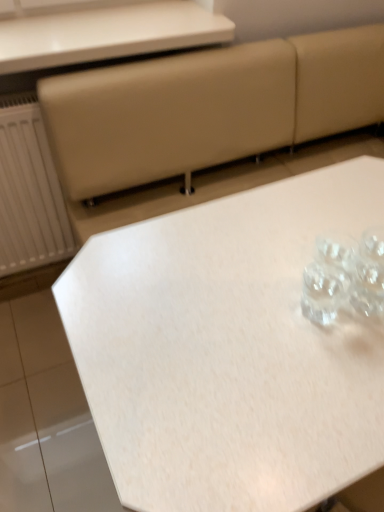
Where is `empty space that is ontop of white matte table at center, the 1th table when ordered from bottom to top (from a real-world perspective)`? empty space that is ontop of white matte table at center, the 1th table when ordered from bottom to top (from a real-world perspective) is located at coordinates (267, 287).